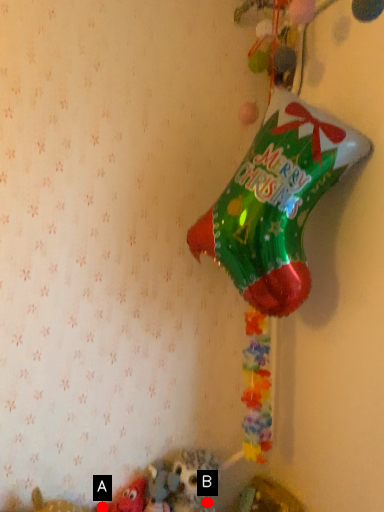
Question: Two points are circled on the image, labeled by A and B beside each circle. Which point appears farthest from the camera in this image?

Choices:
 (A) A is further
 (B) B is further

Answer: (B)